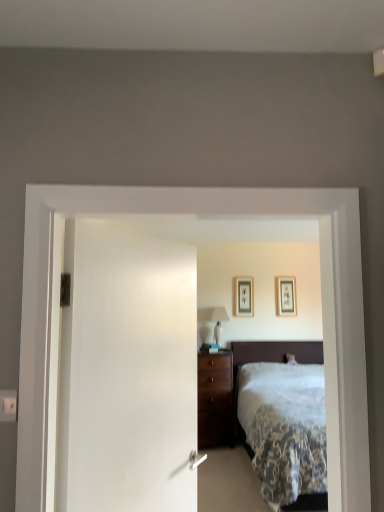
Question: Could you tell me if white glossy table lamp at center is facing white plastic electric outlet at lower left?

Choices:
 (A) no
 (B) yes

Answer: (A)

Question: Can you confirm if white glossy table lamp at center is smaller than white plastic electric outlet at lower left?

Choices:
 (A) no
 (B) yes

Answer: (A)

Question: Considering the relative positions of white glossy table lamp at center and white plastic electric outlet at lower left in the image provided, is white glossy table lamp at center to the left of white plastic electric outlet at lower left from the viewer's perspective?

Choices:
 (A) yes
 (B) no

Answer: (B)

Question: Is white glossy table lamp at center bigger than white plastic electric outlet at lower left?

Choices:
 (A) no
 (B) yes

Answer: (B)

Question: From a real-world perspective, is white glossy table lamp at center located higher than white plastic electric outlet at lower left?

Choices:
 (A) yes
 (B) no

Answer: (B)

Question: From the image's perspective, is white glossy table lamp at center on white plastic electric outlet at lower left?

Choices:
 (A) yes
 (B) no

Answer: (B)

Question: Is white soft bed at center positioned with its back to white plastic electric outlet at lower left?

Choices:
 (A) no
 (B) yes

Answer: (A)

Question: From the image's perspective, would you say white soft bed at center is positioned over white plastic electric outlet at lower left?

Choices:
 (A) no
 (B) yes

Answer: (A)

Question: Is there a large distance between white soft bed at center and white plastic electric outlet at lower left?

Choices:
 (A) no
 (B) yes

Answer: (B)

Question: Can white plastic electric outlet at lower left be found inside white soft bed at center?

Choices:
 (A) no
 (B) yes

Answer: (A)

Question: From the image's perspective, is white soft bed at center below white plastic electric outlet at lower left?

Choices:
 (A) no
 (B) yes

Answer: (B)

Question: Is white soft bed at center not within white plastic electric outlet at lower left?

Choices:
 (A) yes
 (B) no

Answer: (A)

Question: Can you confirm if white plastic electric outlet at lower left is positioned to the left of white glossy table lamp at center?

Choices:
 (A) no
 (B) yes

Answer: (B)